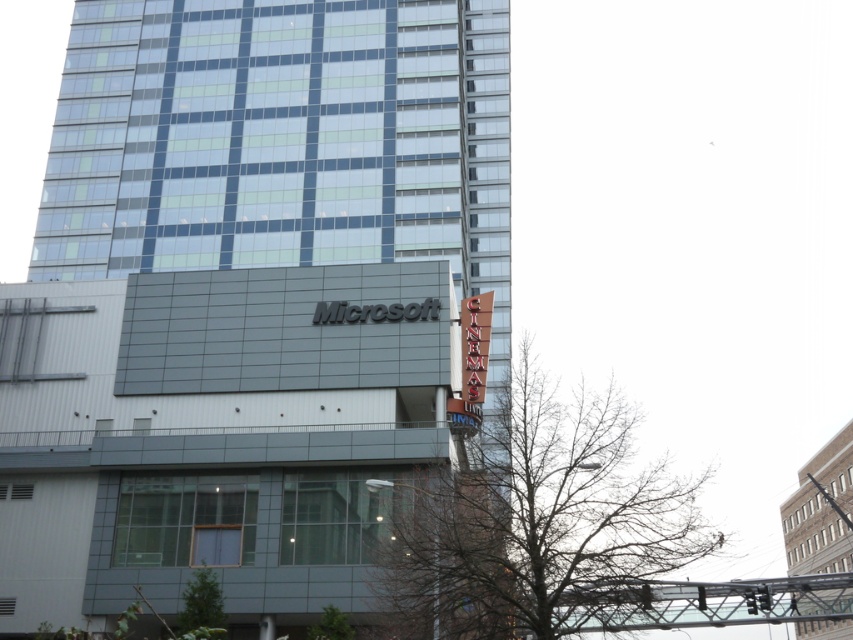
Can you confirm if glassy steel building at center is bigger than gray concrete building at right?

Yes, glassy steel building at center is bigger than gray concrete building at right.

Is point (399, 136) farther from viewer compared to point (833, 621)?

No, (399, 136) is in front of (833, 621).

Where is `glassy steel building at center`? The width and height of the screenshot is (853, 640). glassy steel building at center is located at coordinates (245, 298).